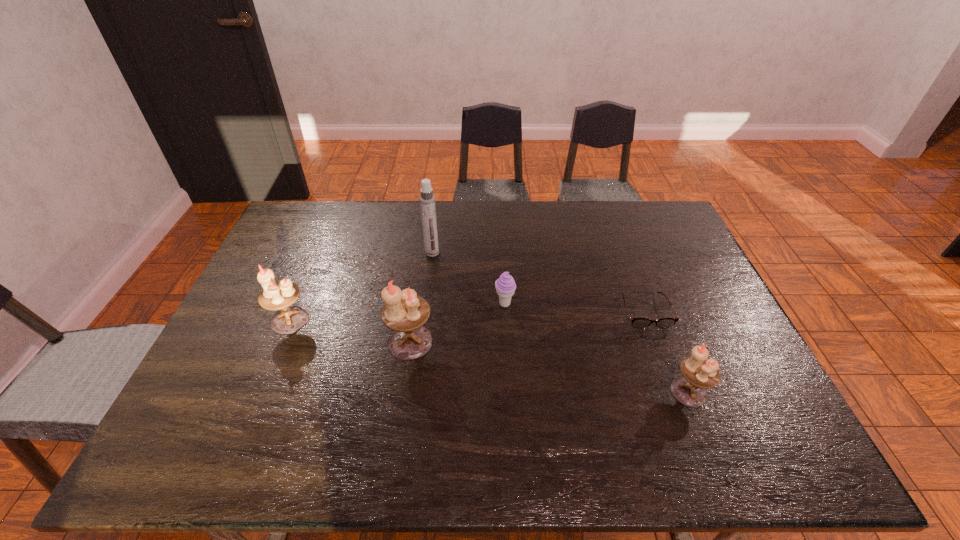
At what (x,y) coordinates should I click in order to perform the action: click on empty space between the second candle holder from left to right and the icecream. Please return your answer as a coordinate pair (x, y). The height and width of the screenshot is (540, 960). Looking at the image, I should click on (458, 323).

At what (x,y) coordinates should I click in order to perform the action: click on free point between the fourth tallest object and the farthest object. Please return your answer as a coordinate pair (x, y). Looking at the image, I should click on 561,322.

You are a GUI agent. You are given a task and a screenshot of the screen. Output one action in this format:
    pyautogui.click(x=<x>, y=<y>)
    Task: Click on the empty space between the farthest object and the third shortest object
    The width and height of the screenshot is (960, 540).
    Given the screenshot: What is the action you would take?
    pyautogui.click(x=561, y=322)

This screenshot has width=960, height=540. Identify the location of free space between the second shortest object and the farthest object. (468, 279).

Locate an element on the screen. The image size is (960, 540). object that is the third nearest to the spectacles is located at coordinates (405, 313).

You are a GUI agent. You are given a task and a screenshot of the screen. Output one action in this format:
    pyautogui.click(x=<x>, y=<y>)
    Task: Click on the fourth closest object to the second shortest candle holder
    Image resolution: width=960 pixels, height=540 pixels.
    Given the screenshot: What is the action you would take?
    (637, 323)

Image resolution: width=960 pixels, height=540 pixels. What are the coordinates of `the closest candle holder relative to the second candle holder from right to left` in the screenshot? It's located at (280, 295).

Locate an element on the screen. The width and height of the screenshot is (960, 540). candle holder that is the second closest one to the nearest object is located at coordinates (280, 295).

The width and height of the screenshot is (960, 540). I want to click on vacant position in the image that satisfies the following two spatial constraints: 1. on the face of the third shortest object; 2. on the right side of the spectacles, so click(674, 392).

Locate an element on the screen. vacant space that satisfies the following two spatial constraints: 1. on the back side of the icecream; 2. on the right side of the second candle holder from right to left is located at coordinates (416, 304).